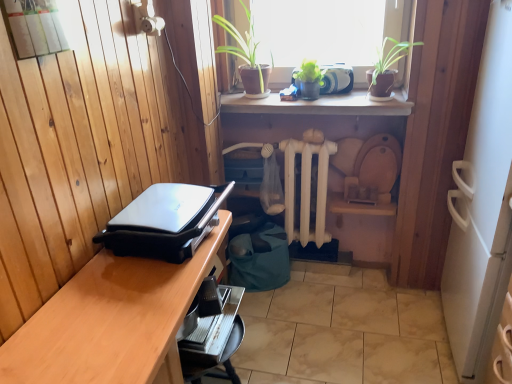
Question: Is green matte plant at upper center far away from green matte plant at upper center?

Choices:
 (A) no
 (B) yes

Answer: (A)

Question: Does green matte plant at upper center have a greater width compared to green matte plant at upper center?

Choices:
 (A) yes
 (B) no

Answer: (B)

Question: Is green matte plant at upper center directly adjacent to green matte plant at upper center?

Choices:
 (A) no
 (B) yes

Answer: (A)

Question: From a real-world perspective, does green matte plant at upper center sit lower than green matte plant at upper center?

Choices:
 (A) yes
 (B) no

Answer: (A)

Question: From the image's perspective, is green matte plant at upper center over green matte plant at upper center?

Choices:
 (A) yes
 (B) no

Answer: (B)

Question: Based on their positions, is green matte plant at upper center located to the left or right of green matte plant at upper center?

Choices:
 (A) left
 (B) right

Answer: (A)

Question: Considering the positions of green matte plant at upper center and green matte plant at upper center in the image, is green matte plant at upper center taller or shorter than green matte plant at upper center?

Choices:
 (A) tall
 (B) short

Answer: (A)

Question: Is point (248, 82) closer or farther from the camera than point (321, 74)?

Choices:
 (A) closer
 (B) farther

Answer: (B)

Question: Is green matte plant at upper center wider or thinner than green matte plant at upper center?

Choices:
 (A) wide
 (B) thin

Answer: (A)

Question: Visually, is green leafy plants at upper center positioned to the left or to the right of black plastic grill at left?

Choices:
 (A) left
 (B) right

Answer: (B)

Question: In terms of height, does green leafy plants at upper center look taller or shorter compared to black plastic grill at left?

Choices:
 (A) tall
 (B) short

Answer: (A)

Question: From a real-world perspective, is green leafy plants at upper center physically located above or below black plastic grill at left?

Choices:
 (A) below
 (B) above

Answer: (B)

Question: Considering their positions, is green leafy plants at upper center located in front of or behind black plastic grill at left?

Choices:
 (A) front
 (B) behind

Answer: (B)

Question: Considering the relative positions of green matte plant at upper center and black plastic grill at left in the image provided, is green matte plant at upper center to the left or to the right of black plastic grill at left?

Choices:
 (A) left
 (B) right

Answer: (B)

Question: From the image's perspective, is green matte plant at upper center positioned above or below black plastic grill at left?

Choices:
 (A) above
 (B) below

Answer: (A)